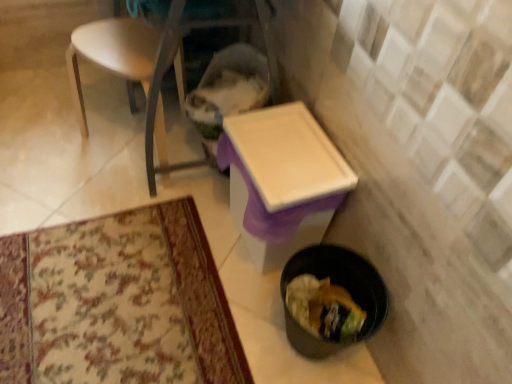
Where is `vacant space to the left of black plastic trash can at lower right`? The width and height of the screenshot is (512, 384). vacant space to the left of black plastic trash can at lower right is located at coordinates (231, 320).